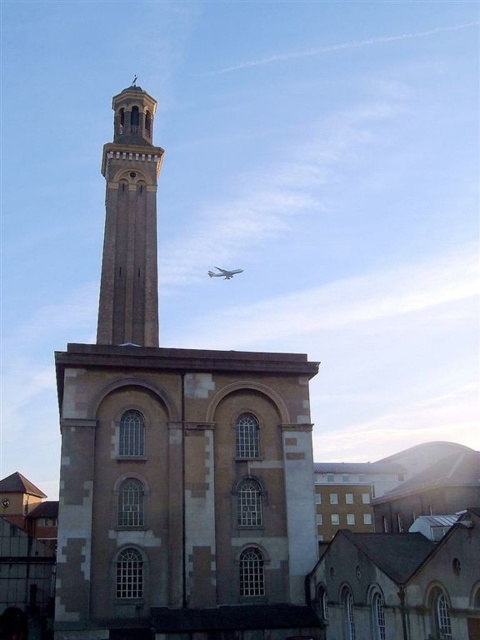
Question: Among these points, which one is farthest from the camera?

Choices:
 (A) (215, 275)
 (B) (154, 314)

Answer: (A)

Question: Among these objects, which one is nearest to the camera?

Choices:
 (A) light brown stone tower at upper center
 (B) brown stone tower at center
 (C) white glossy airplane at upper center

Answer: (B)

Question: Is brown stone tower at center in front of white glossy airplane at upper center?

Choices:
 (A) yes
 (B) no

Answer: (A)

Question: Does brown stone tower at center appear on the right side of light brown stone tower at upper center?

Choices:
 (A) yes
 (B) no

Answer: (A)

Question: Considering the relative positions of brown stone tower at center and white glossy airplane at upper center in the image provided, where is brown stone tower at center located with respect to white glossy airplane at upper center?

Choices:
 (A) left
 (B) right

Answer: (A)

Question: Which of these objects is positioned closest to the brown stone tower at center?

Choices:
 (A) light brown stone tower at upper center
 (B) white glossy airplane at upper center

Answer: (A)